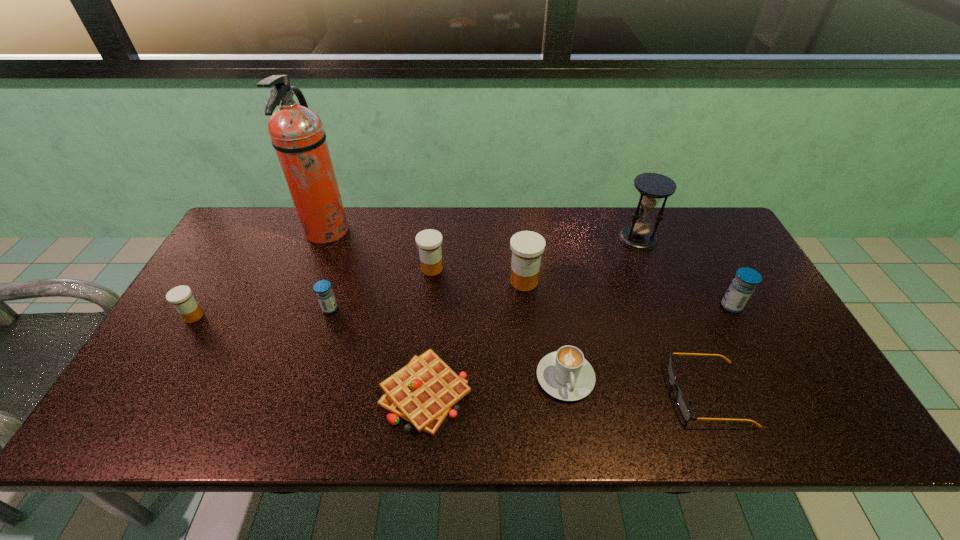
This screenshot has height=540, width=960. In order to click on fire extinguisher in this screenshot , I will do `click(297, 134)`.

This screenshot has height=540, width=960. In order to click on black hourglass in this screenshot , I will do `click(653, 187)`.

I want to click on hourglass, so click(653, 187).

Locate an element on the screen. the tallest medicine is located at coordinates (527, 247).

Find the location of `the eighth shortest object`. the eighth shortest object is located at coordinates (527, 247).

At what (x,y) coordinates should I click in order to perform the action: click on the second biggest orange medicine. Please return your answer as a coordinate pair (x, y). This screenshot has width=960, height=540. Looking at the image, I should click on (429, 241).

Image resolution: width=960 pixels, height=540 pixels. Find the location of `the third medicine from right to left`. the third medicine from right to left is located at coordinates (429, 241).

Identify the location of the right blue medicine. The image size is (960, 540). (741, 288).

The image size is (960, 540). What are the coordinates of `the rightmost object` in the screenshot? It's located at (741, 288).

The width and height of the screenshot is (960, 540). I want to click on the second medicine from left to right, so click(x=322, y=288).